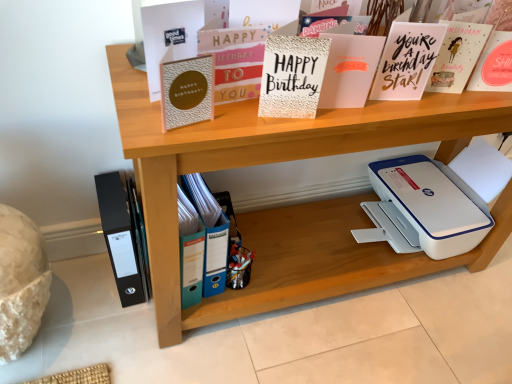
The image size is (512, 384). I want to click on vacant area that lies between wooden shelf at upper center and black matte folder at lower left, so click(x=139, y=329).